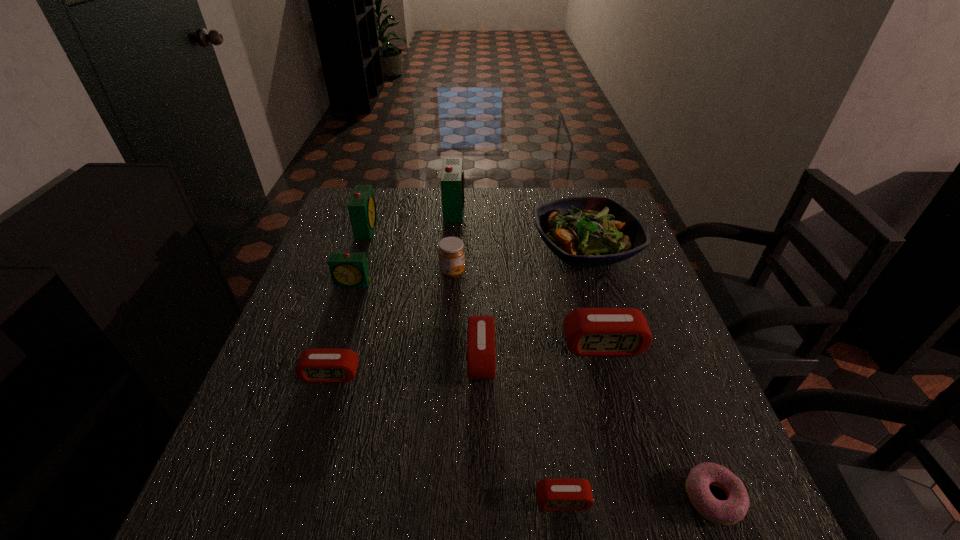
The height and width of the screenshot is (540, 960). Identify the location of vacant position in the image that satisfies the following two spatial constraints: 1. on the front-facing side of the biggest green alarm clock; 2. on the front-facing side of the fifth nearest alarm clock. (448, 284).

Identify the location of free space that satisfies the following two spatial constraints: 1. on the front label of the doughnut; 2. on the left side of the jam. (436, 497).

I want to click on vacant region that satisfies the following two spatial constraints: 1. on the back side of the doughnut; 2. on the front label of the jam, so click(627, 273).